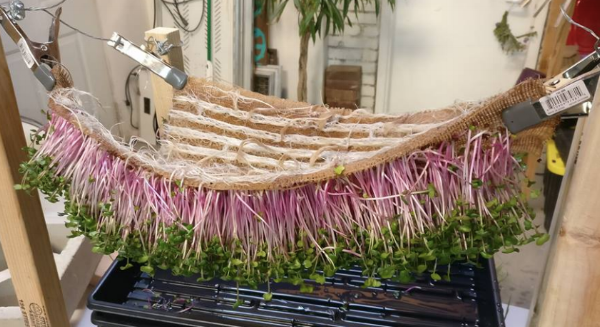
Locate an element on the screen. The image size is (600, 327). white wall is located at coordinates (442, 48), (111, 15).